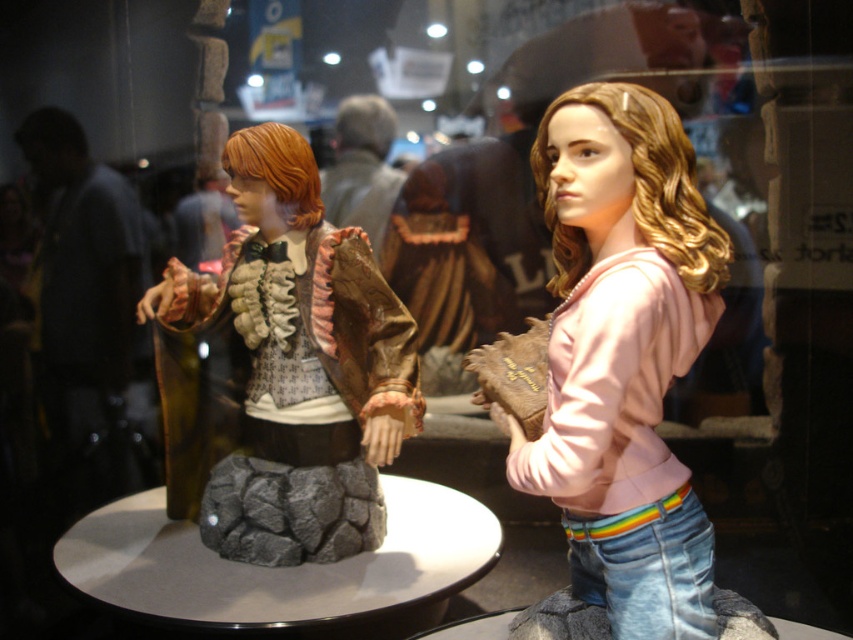
You are a visitor at the exhibition and want to describe the arrangement of the pink matte hoodie at center and the matte brown hair at center in the glass case. Which one is positioned higher?

The pink matte hoodie at center is located above matte brown hair at center, so it is positioned higher.

You are a visitor at the exhibition and want to take a photo of the pink matte hoodie at center and the matte brown hair at center. Since the lighting is low, you need to ensure both are visible. Which object should you focus on first to make sure both are in focus?

You should focus on the matte brown hair at center first because it is behind the pink matte hoodie at center. By focusing on the farther object, the foreground object will also be in focus due to depth of field.

You are a visitor at the exhibition and want to take a photo of the pink matte hoodie at center. The glass case has a reflective surface. To avoid reflections, you should position yourself so that the light source is directly behind you. Given that the pink matte hoodie at center is located at point (624, 355), where should you stand relative to the glass case to ensure the best lighting?

To take a clear photo of the pink matte hoodie at center located at point (624, 355), position yourself directly behind the light source so that the light shines onto the hoodie and away from the camera. This will minimize reflections on the glass case.